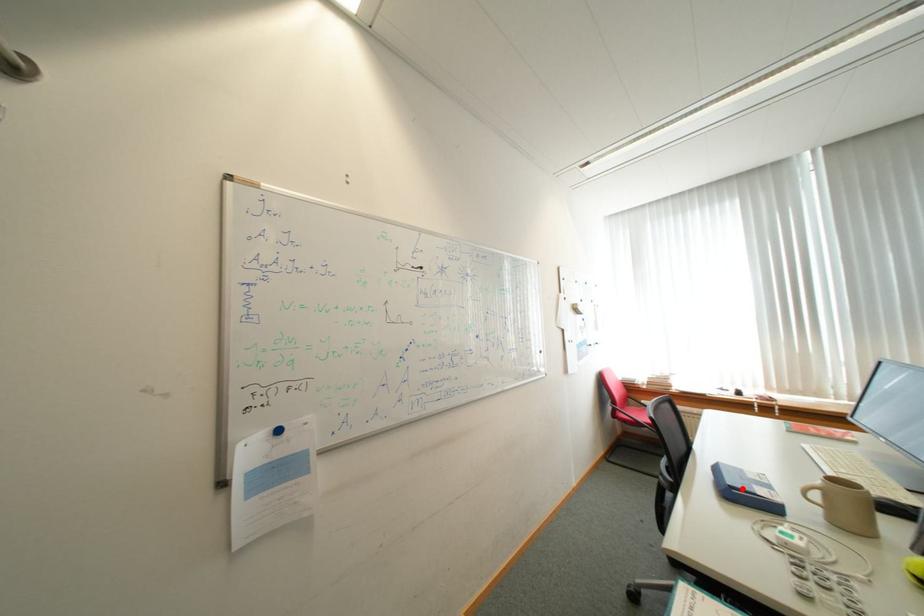
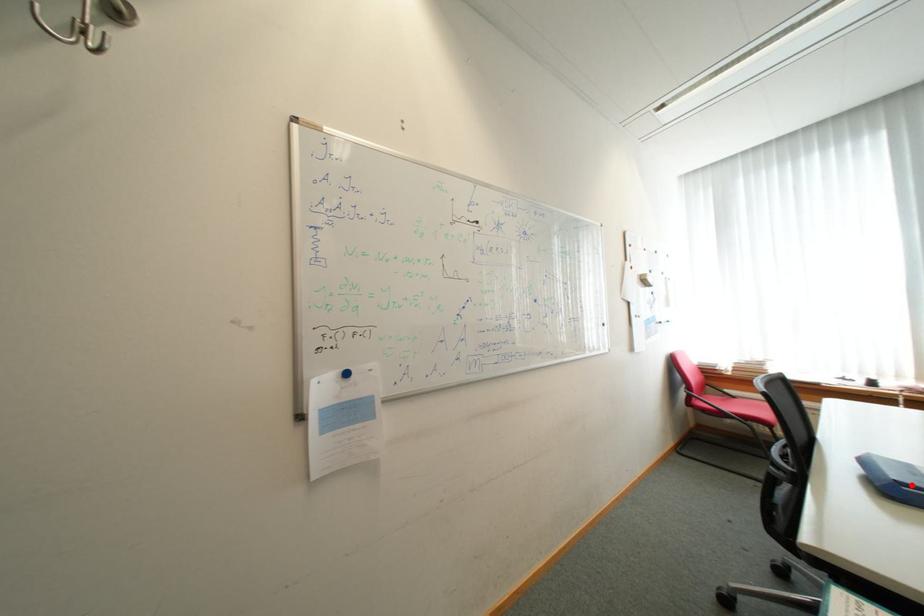
I am providing you with two images of the same scene from different viewpoints. A red point is marked on the first image and another point is marked on the second image. Is the red point in image1 aligned with the point shown in image2?

Yes